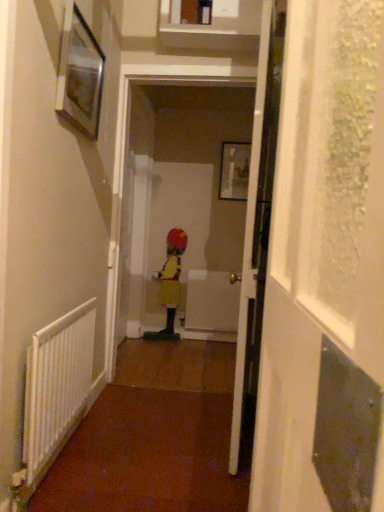
Question: Is transparent textured screen door at right surrounding metallic silver picture frame at upper left, which is the first picture frame from front to back?

Choices:
 (A) no
 (B) yes

Answer: (A)

Question: Is transparent textured screen door at right closer to the viewer compared to metallic silver picture frame at upper left, placed as the first picture frame when sorted from left to right?

Choices:
 (A) no
 (B) yes

Answer: (B)

Question: From the image's perspective, would you say transparent textured screen door at right is shown under metallic silver picture frame at upper left, which ranks as the second picture frame in right-to-left order?

Choices:
 (A) no
 (B) yes

Answer: (B)

Question: Is transparent textured screen door at right placed right next to metallic silver picture frame at upper left, placed as the first picture frame when sorted from left to right?

Choices:
 (A) yes
 (B) no

Answer: (B)

Question: Is transparent textured screen door at right turned away from metallic silver picture frame at upper left, which is the first picture frame from front to back?

Choices:
 (A) yes
 (B) no

Answer: (B)

Question: Based on their positions, is matte black picture frame at upper center, which is counted as the second picture frame, starting from the front, located to the left or right of metallic silver picture frame at upper left, which is the first picture frame from front to back?

Choices:
 (A) left
 (B) right

Answer: (B)

Question: Relative to metallic silver picture frame at upper left, which ranks as the second picture frame in right-to-left order, is matte black picture frame at upper center, marked as the first picture frame in a back-to-front arrangement, in front or behind?

Choices:
 (A) behind
 (B) front

Answer: (A)

Question: Would you say matte black picture frame at upper center, the second picture frame when ordered from left to right, is inside or outside metallic silver picture frame at upper left, which ranks as the second picture frame in right-to-left order?

Choices:
 (A) inside
 (B) outside

Answer: (B)

Question: From a real-world perspective, is matte black picture frame at upper center, arranged as the first picture frame when viewed from the right, positioned above or below metallic silver picture frame at upper left, placed as the first picture frame when sorted from left to right?

Choices:
 (A) below
 (B) above

Answer: (A)

Question: In terms of width, does white plastic radiator at left look wider or thinner when compared to white glossy door at center?

Choices:
 (A) thin
 (B) wide

Answer: (A)

Question: Is white plastic radiator at left to the left or to the right of white glossy door at center in the image?

Choices:
 (A) left
 (B) right

Answer: (A)

Question: From the image's perspective, is white plastic radiator at left positioned above or below white glossy door at center?

Choices:
 (A) below
 (B) above

Answer: (A)

Question: Which is correct: white plastic radiator at left is inside white glossy door at center, or outside of it?

Choices:
 (A) outside
 (B) inside

Answer: (A)

Question: In terms of size, does white plastic radiator at left appear bigger or smaller than yellow matte dress at center?

Choices:
 (A) big
 (B) small

Answer: (B)

Question: From the image's perspective, is white plastic radiator at left positioned above or below yellow matte dress at center?

Choices:
 (A) above
 (B) below

Answer: (B)